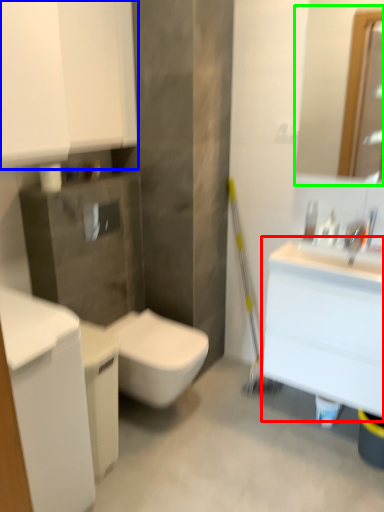
Question: Estimate the real-world distances between objects in this image. Which object is closer to counter top (highlighted by a red box), bathroom cabinet (highlighted by a blue box) or mirror (highlighted by a green box)?

Choices:
 (A) bathroom cabinet
 (B) mirror

Answer: (A)